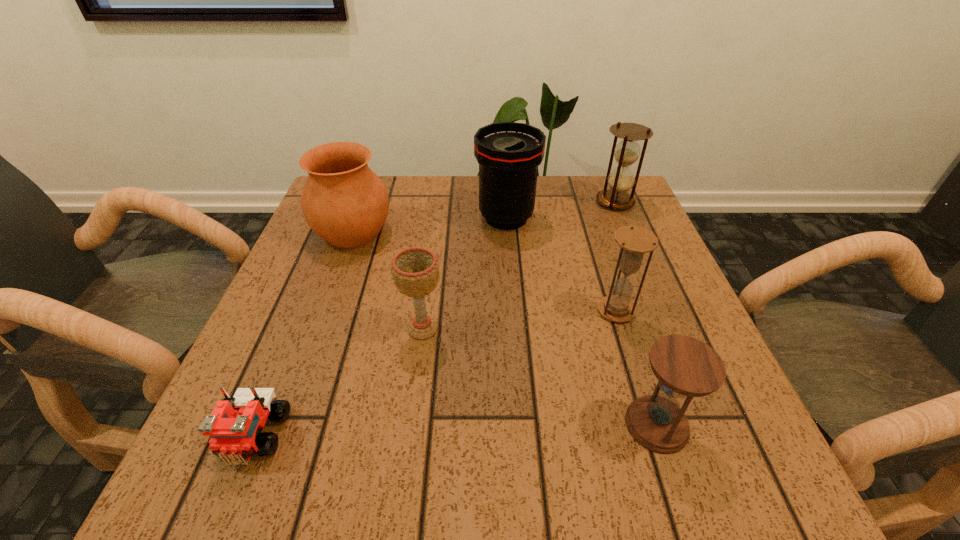
The height and width of the screenshot is (540, 960). Find the location of `object at the far left corner`. object at the far left corner is located at coordinates (343, 201).

You are a GUI agent. You are given a task and a screenshot of the screen. Output one action in this format:
    pyautogui.click(x=<x>, y=<y>)
    Task: Click on the object that is at the near left corner
    This screenshot has height=540, width=960.
    Given the screenshot: What is the action you would take?
    (235, 426)

Image resolution: width=960 pixels, height=540 pixels. Identify the location of object present at the far right corner. (621, 179).

The width and height of the screenshot is (960, 540). What are the coordinates of `object located in the near right corner section of the desktop` in the screenshot? It's located at (686, 367).

Image resolution: width=960 pixels, height=540 pixels. I want to click on vacant space at the far edge of the desktop, so click(448, 194).

Find the location of a particular element. This screenshot has width=960, height=540. vacant space at the near edge of the desktop is located at coordinates (377, 480).

Find the location of a particular element. free space at the left edge of the desktop is located at coordinates (302, 390).

In the image, there is a desktop. At what (x,y) coordinates should I click in order to perform the action: click on vacant space at the right edge. Please return your answer as a coordinate pair (x, y). The image size is (960, 540). Looking at the image, I should click on (677, 309).

Locate an element on the screen. This screenshot has height=540, width=960. free space at the near left corner is located at coordinates (194, 457).

Image resolution: width=960 pixels, height=540 pixels. I want to click on unoccupied area between the Lego and the telephoto lens, so click(380, 327).